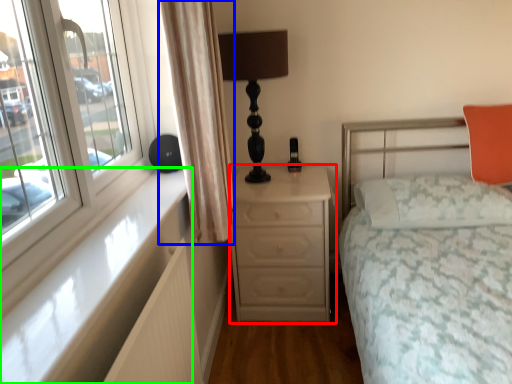
Question: Which is nearer to the chest of drawers (highlighted by a red box)? curtain (highlighted by a blue box) or window sill (highlighted by a green box).

Choices:
 (A) curtain
 (B) window sill

Answer: (A)